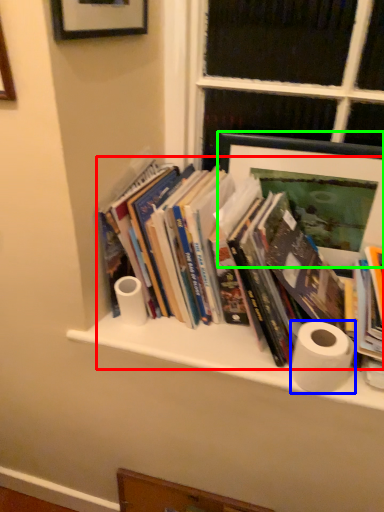
Question: Based on their relative distances, which object is nearer to book (highlighted by a red box)? Choose from toilet paper (highlighted by a blue box) and picture frame (highlighted by a green box).

Choices:
 (A) toilet paper
 (B) picture frame

Answer: (B)